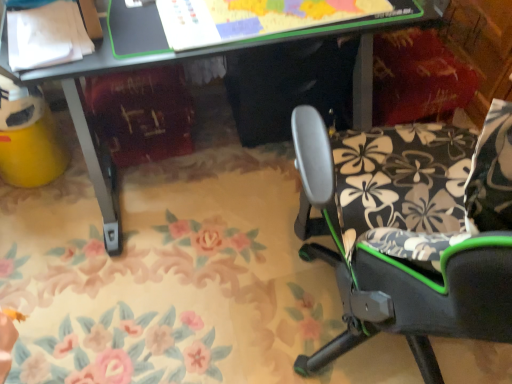
Describe the element at coordinates (87, 119) in the screenshot. This screenshot has width=512, height=384. I see `matte black desk at center` at that location.

At what (x,y) coordinates should I click in order to perform the action: click on matte black desk at center. Please return your answer as a coordinate pair (x, y). Looking at the image, I should click on (87, 119).

What are the coordinates of `black fabric chair at right` in the screenshot? It's located at (411, 230).

Measure the distance between black fabric chair at right and camera.

black fabric chair at right and camera are 15.17 inches apart from each other.

Looking at this image, measure the distance between point (314, 184) and camera.

The distance of point (314, 184) from camera is 33.39 inches.

What do you see at coordinates (411, 230) in the screenshot? I see `black fabric chair at right` at bounding box center [411, 230].

I want to click on matte black desk at center, so click(x=87, y=119).

Considering the positions of objects matte black desk at center and black fabric chair at right in the image provided, who is more to the right, matte black desk at center or black fabric chair at right?

black fabric chair at right.

Which object is more forward, matte black desk at center or black fabric chair at right?

black fabric chair at right is closer to the camera.

Is point (64, 66) closer to camera compared to point (417, 188)?

Yes, point (64, 66) is in front of point (417, 188).

From the image's perspective, is matte black desk at center over black fabric chair at right?

Indeed, from the image's perspective, matte black desk at center is shown above black fabric chair at right.

From a real-world perspective, between matte black desk at center and black fabric chair at right, who is vertically lower?

matte black desk at center, from a real-world perspective.

Does matte black desk at center have a lesser width compared to black fabric chair at right?

No.

In terms of height, does matte black desk at center look taller or shorter compared to black fabric chair at right?

Considering their sizes, matte black desk at center has more height than black fabric chair at right.

Who is bigger, matte black desk at center or black fabric chair at right?

matte black desk at center is bigger.

Is matte black desk at center not within black fabric chair at right?

Indeed, matte black desk at center is completely outside black fabric chair at right.

Consider the image. Does matte black desk at center touch black fabric chair at right?

No, matte black desk at center is not with black fabric chair at right.

Could you tell me if matte black desk at center is facing black fabric chair at right?

Yes.

Can you tell me how much matte black desk at center and black fabric chair at right differ in facing direction?

They differ by 138 degrees in their facing directions.

I want to click on desk located above the black fabric chair at right (from the image's perspective), so click(87, 119).

Between black fabric chair at right and matte black desk at center, which one appears on the left side from the viewer's perspective?

Positioned to the left is matte black desk at center.

Is black fabric chair at right further to camera compared to matte black desk at center?

No, black fabric chair at right is in front of matte black desk at center.

Which is less distant, (347, 263) or (362, 69)?

The point (347, 263) is closer.

From the image's perspective, would you say black fabric chair at right is shown under matte black desk at center?

Correct, black fabric chair at right appears lower than matte black desk at center in the image.

From a real-world perspective, is black fabric chair at right positioned above or below matte black desk at center?

From a real-world perspective, black fabric chair at right is physically above matte black desk at center.

Can you confirm if black fabric chair at right is wider than matte black desk at center?

No, black fabric chair at right is not wider than matte black desk at center.

Between black fabric chair at right and matte black desk at center, which one has more height?

Standing taller between the two is matte black desk at center.

In the scene shown: Is black fabric chair at right smaller than matte black desk at center?

Yes.

Do you think black fabric chair at right is within matte black desk at center, or outside of it?

black fabric chair at right is spatially situated outside matte black desk at center.

Are black fabric chair at right and matte black desk at center far apart?

They are positioned close to each other.

Is matte black desk at center at the back of black fabric chair at right?

No, matte black desk at center is not at the back of black fabric chair at right.

How many degrees apart are the facing directions of black fabric chair at right and matte black desk at center?

They differ by 138 degrees in their facing directions.

Find the location of a particular element. Image resolution: width=512 pixels, height=384 pixels. desk above the black fabric chair at right (from the image's perspective) is located at coordinates (87, 119).

Where is `desk below the black fabric chair at right (from a real-world perspective)`? desk below the black fabric chair at right (from a real-world perspective) is located at coordinates (87, 119).

Locate an element on the screen. This screenshot has height=384, width=512. desk behind the black fabric chair at right is located at coordinates (87, 119).